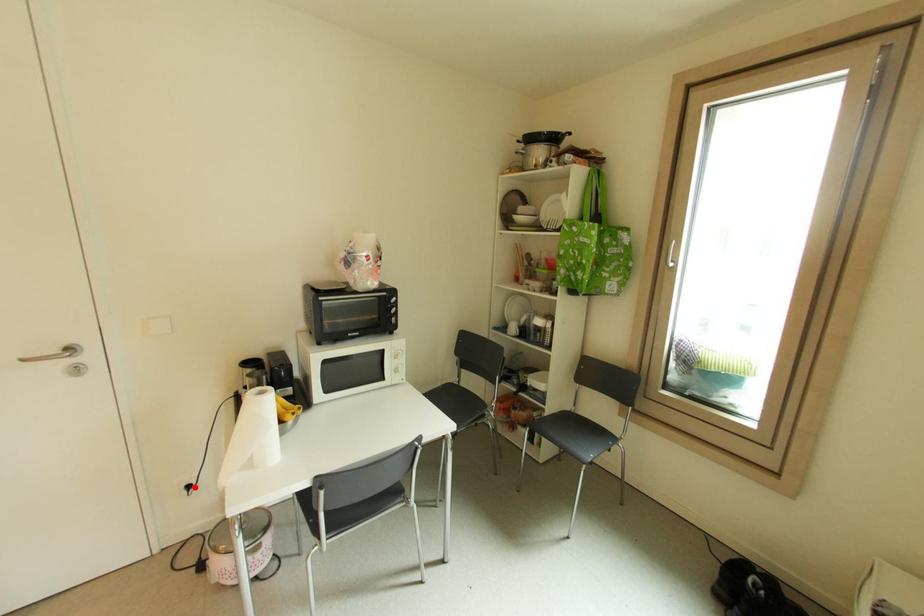
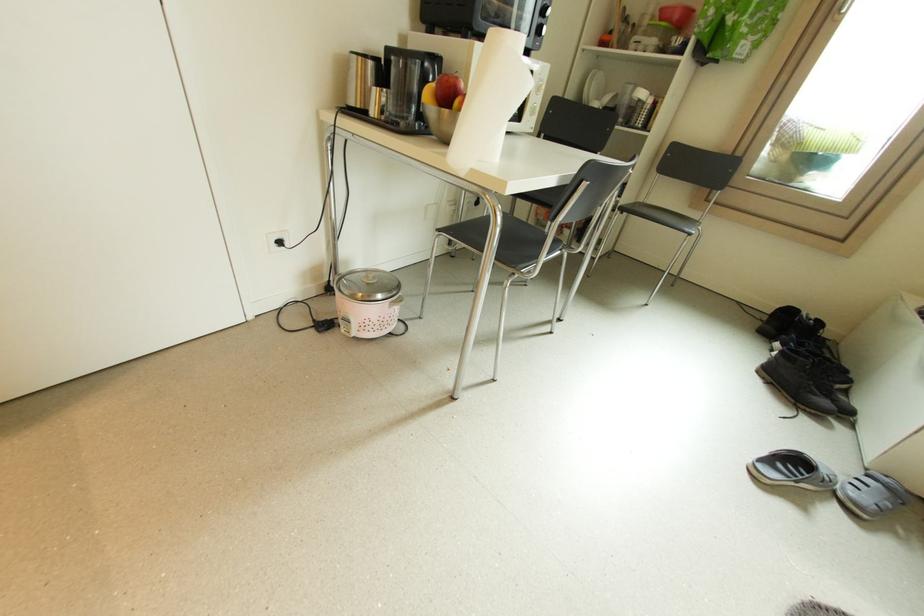
Question: I am providing you with two images of the same scene from different viewpoints. Given a red point in image1, look at the same physical point in image2. Is it:

Choices:
 (A) Closer to the viewpoint
 (B) Farther from the viewpoint

Answer: (A)